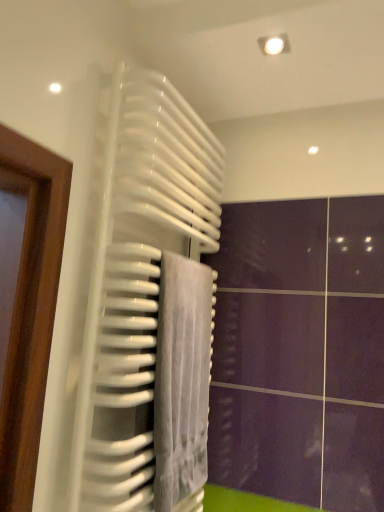
In order to face gray velvety towel at center, should I rotate leftwards or rightwards?

It's best to rotate left around 0.888 degrees.

This screenshot has height=512, width=384. Describe the element at coordinates (182, 382) in the screenshot. I see `gray velvety towel at center` at that location.

Image resolution: width=384 pixels, height=512 pixels. Identify the location of gray velvety towel at center. coord(182,382).

What do you see at coordinates (128, 284) in the screenshot? I see `white glossy radiator at center` at bounding box center [128, 284].

Identify the location of white glossy radiator at center. This screenshot has height=512, width=384. (128, 284).

At what (x,y) coordinates should I click in order to perform the action: click on gray velvety towel at center. Please return your answer as a coordinate pair (x, y). Looking at the image, I should click on (182, 382).

Which is more to the right, white glossy radiator at center or gray velvety towel at center?

From the viewer's perspective, gray velvety towel at center appears more on the right side.

Is white glossy radiator at center closer to camera compared to gray velvety towel at center?

Yes, white glossy radiator at center is in front of gray velvety towel at center.

Does point (138, 246) come closer to viewer compared to point (190, 381)?

That is True.

From the image's perspective, which object appears higher, white glossy radiator at center or gray velvety towel at center?

white glossy radiator at center appears higher in the image.

From a real-world perspective, which object stands above the other?

From a 3D spatial view, white glossy radiator at center is above.

Between white glossy radiator at center and gray velvety towel at center, which one has smaller width?

gray velvety towel at center.

Can you confirm if white glossy radiator at center is taller than gray velvety towel at center?

Indeed, white glossy radiator at center has a greater height compared to gray velvety towel at center.

Between white glossy radiator at center and gray velvety towel at center, which one has smaller size?

With smaller size is gray velvety towel at center.

Based on the photo, is white glossy radiator at center not inside gray velvety towel at center?

white glossy radiator at center is positioned outside gray velvety towel at center.

Is white glossy radiator at center positioned far away from gray velvety towel at center?

white glossy radiator at center is near gray velvety towel at center, not far away.

Is white glossy radiator at center turned away from gray velvety towel at center?

Absolutely, white glossy radiator at center is directed away from gray velvety towel at center.

How different are the orientations of white glossy radiator at center and gray velvety towel at center in degrees?

They differ by 0.00211 degrees in their facing directions.

How much distance is there between white glossy radiator at center and gray velvety towel at center?

white glossy radiator at center is 7.19 inches from gray velvety towel at center.

In order to click on towel on the right side of white glossy radiator at center in this screenshot , I will do `click(182, 382)`.

Looking at this image, in the image, is gray velvety towel at center on the left side or the right side of white glossy radiator at center?

Clearly, gray velvety towel at center is on the right of white glossy radiator at center in the image.

Considering the positions of objects gray velvety towel at center and white glossy radiator at center in the image provided, who is in front, gray velvety towel at center or white glossy radiator at center?

Positioned in front is white glossy radiator at center.

Is point (194, 347) less distant than point (122, 357)?

No, (194, 347) is behind (122, 357).

From the image's perspective, does gray velvety towel at center appear higher than white glossy radiator at center?

No.

From a real-world perspective, is gray velvety towel at center positioned under white glossy radiator at center based on gravity?

Yes, from a real-world perspective, gray velvety towel at center is under white glossy radiator at center.

Considering the sizes of gray velvety towel at center and white glossy radiator at center in the image, is gray velvety towel at center wider or thinner than white glossy radiator at center?

Considering their sizes, gray velvety towel at center looks slimmer than white glossy radiator at center.

Between gray velvety towel at center and white glossy radiator at center, which one has more height?

With more height is white glossy radiator at center.

Which of these two, gray velvety towel at center or white glossy radiator at center, is bigger?

white glossy radiator at center is bigger.

Is gray velvety towel at center not inside white glossy radiator at center?

That's incorrect, gray velvety towel at center is not completely outside white glossy radiator at center.

Are gray velvety towel at center and white glossy radiator at center making contact?

No, gray velvety towel at center is not beside white glossy radiator at center.

Could you tell me if gray velvety towel at center is turned towards white glossy radiator at center?

Yes, gray velvety towel at center is aimed at white glossy radiator at center.

Measure the distance from gray velvety towel at center to white glossy radiator at center.

They are 7.19 inches apart.

This screenshot has height=512, width=384. Find the location of `radiator in front of the gray velvety towel at center`. radiator in front of the gray velvety towel at center is located at coordinates (128, 284).

Locate an element on the screen. Image resolution: width=384 pixels, height=512 pixels. towel below the white glossy radiator at center (from a real-world perspective) is located at coordinates (182, 382).

At what (x,y) coordinates should I click in order to perform the action: click on radiator lying in front of the gray velvety towel at center. Please return your answer as a coordinate pair (x, y). This screenshot has height=512, width=384. Looking at the image, I should click on (128, 284).